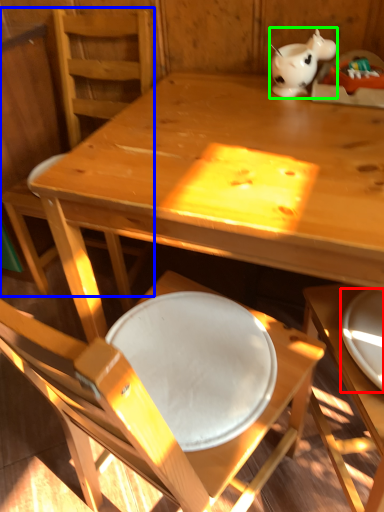
Question: Which is farther away from plate (highlighted by a red box)? chair (highlighted by a blue box) or tableware (highlighted by a green box)?

Choices:
 (A) chair
 (B) tableware

Answer: (A)